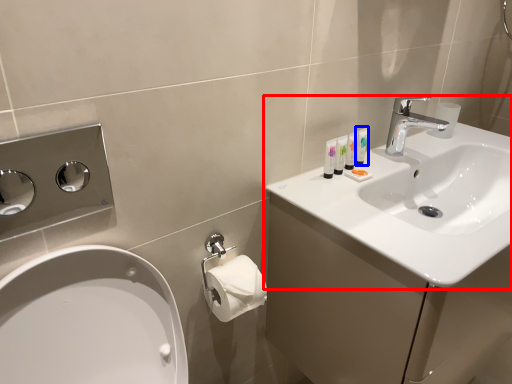
Question: Which object is further to the camera taking this photo, sink (highlighted by a red box) or mouthwash (highlighted by a blue box)?

Choices:
 (A) sink
 (B) mouthwash

Answer: (B)